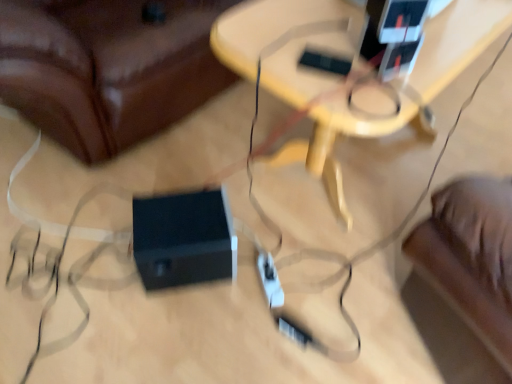
Question: Is black plastic speaker at lower center with black plastic speaker at lower center?

Choices:
 (A) no
 (B) yes

Answer: (A)

Question: Does black plastic speaker at lower center have a lesser height compared to black plastic speaker at lower center?

Choices:
 (A) yes
 (B) no

Answer: (A)

Question: Is black plastic speaker at lower center taller than black plastic speaker at lower center?

Choices:
 (A) yes
 (B) no

Answer: (B)

Question: Would you say black plastic speaker at lower center is a long distance from black plastic speaker at lower center?

Choices:
 (A) yes
 (B) no

Answer: (B)

Question: Is black plastic speaker at lower center closer to the viewer compared to black plastic speaker at lower center?

Choices:
 (A) yes
 (B) no

Answer: (B)

Question: Considering the relative sizes of black plastic speaker at lower center and black plastic speaker at lower center in the image provided, is black plastic speaker at lower center thinner than black plastic speaker at lower center?

Choices:
 (A) no
 (B) yes

Answer: (B)

Question: Does wooden table at center have a smaller size compared to black plastic speaker at lower center?

Choices:
 (A) no
 (B) yes

Answer: (A)

Question: From the image's perspective, is wooden table at center beneath black plastic speaker at lower center?

Choices:
 (A) no
 (B) yes

Answer: (A)

Question: Is wooden table at center shorter than black plastic speaker at lower center?

Choices:
 (A) no
 (B) yes

Answer: (A)

Question: Can we say wooden table at center lies outside black plastic speaker at lower center?

Choices:
 (A) yes
 (B) no

Answer: (A)

Question: Does wooden table at center have a larger size compared to black plastic speaker at lower center?

Choices:
 (A) yes
 (B) no

Answer: (A)

Question: Is wooden table at center in contact with black plastic speaker at lower center?

Choices:
 (A) yes
 (B) no

Answer: (B)

Question: Is black plastic speaker at lower center outside black plastic speaker at lower center?

Choices:
 (A) no
 (B) yes

Answer: (B)